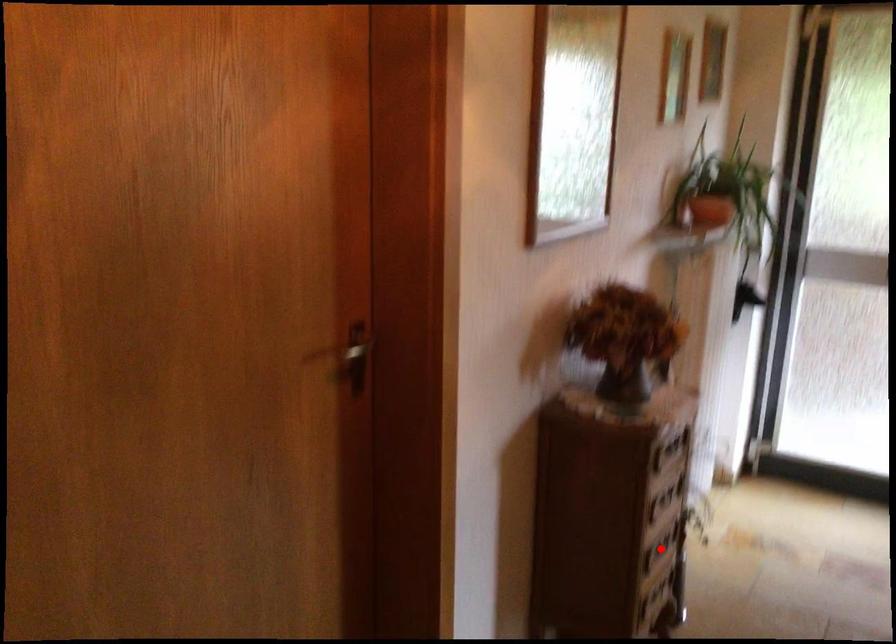
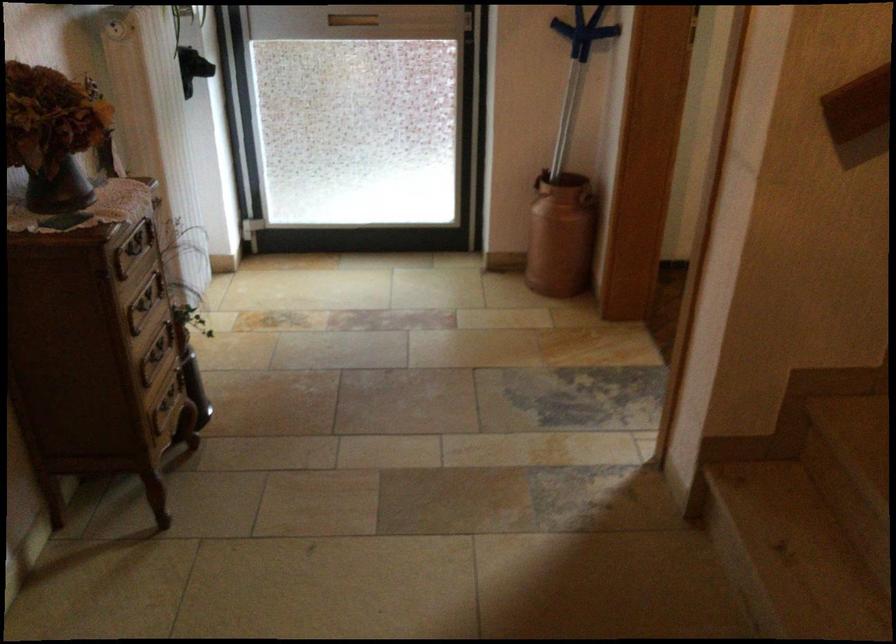
Find the pixel in the second image that matches the highlighted location in the first image.

(156, 355)